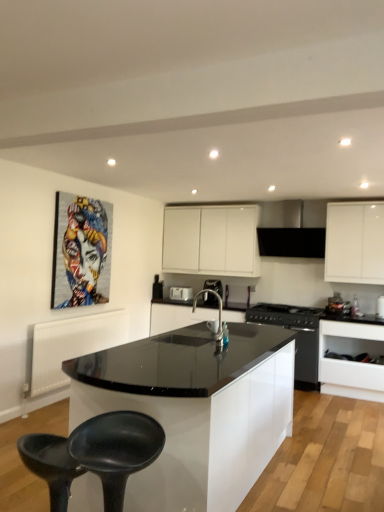
Question: Is black glossy countertop at center, the 2th cabinetry when ordered from top to bottom, behind white glossy toaster at center, arranged as the 1th appliance when viewed from the left?

Choices:
 (A) no
 (B) yes

Answer: (A)

Question: Is the depth of black glossy countertop at center, the 2th cabinetry when ordered from top to bottom, less than that of white glossy toaster at center, the 1th appliance positioned from the back?

Choices:
 (A) no
 (B) yes

Answer: (B)

Question: Can white glossy toaster at center, arranged as the 1th appliance when viewed from the left, be found inside black glossy countertop at center, the second cabinetry in the bottom-to-top sequence?

Choices:
 (A) yes
 (B) no

Answer: (B)

Question: Is black glossy countertop at center, the second cabinetry in the bottom-to-top sequence, to the right of white glossy toaster at center, which is the second appliance in front-to-back order, from the viewer's perspective?

Choices:
 (A) yes
 (B) no

Answer: (A)

Question: From a real-world perspective, is black glossy countertop at center, the second cabinetry in the bottom-to-top sequence, physically below white glossy toaster at center, which ranks as the 2th appliance in right-to-left order?

Choices:
 (A) no
 (B) yes

Answer: (B)

Question: From the image's perspective, does black glossy countertop at center, the 2th cabinetry when ordered from top to bottom, appear higher than white glossy toaster at center, which ranks as the 2th appliance in right-to-left order?

Choices:
 (A) yes
 (B) no

Answer: (B)

Question: From the image's perspective, is black glossy microwave at center, the first appliance when ordered from front to back, over black glossy countertop at center, the 2th cabinetry when ordered from top to bottom?

Choices:
 (A) yes
 (B) no

Answer: (A)

Question: Is black glossy microwave at center, placed as the second appliance when sorted from back to front, aimed at black glossy countertop at center, the second cabinetry in the bottom-to-top sequence?

Choices:
 (A) yes
 (B) no

Answer: (B)

Question: From the image's perspective, would you say black glossy microwave at center, the 1th appliance when ordered from right to left, is shown under black glossy countertop at center, the 2th cabinetry when ordered from top to bottom?

Choices:
 (A) no
 (B) yes

Answer: (A)

Question: Can you confirm if black glossy microwave at center, placed as the 2th appliance when sorted from left to right, is taller than black glossy countertop at center, the 2th cabinetry when ordered from top to bottom?

Choices:
 (A) no
 (B) yes

Answer: (A)

Question: Considering the relative sizes of black glossy microwave at center, placed as the 2th appliance when sorted from left to right, and black glossy countertop at center, the second cabinetry in the bottom-to-top sequence, in the image provided, is black glossy microwave at center, placed as the 2th appliance when sorted from left to right, shorter than black glossy countertop at center, the second cabinetry in the bottom-to-top sequence,?

Choices:
 (A) yes
 (B) no

Answer: (A)

Question: Considering the relative sizes of black glossy microwave at center, placed as the second appliance when sorted from back to front, and black glossy countertop at center, the second cabinetry in the bottom-to-top sequence, in the image provided, is black glossy microwave at center, placed as the second appliance when sorted from back to front, bigger than black glossy countertop at center, the second cabinetry in the bottom-to-top sequence,?

Choices:
 (A) no
 (B) yes

Answer: (A)

Question: Is satin nickel faucet at center facing away from white glossy drawer at lower right, the third cabinetry from the top?

Choices:
 (A) no
 (B) yes

Answer: (A)